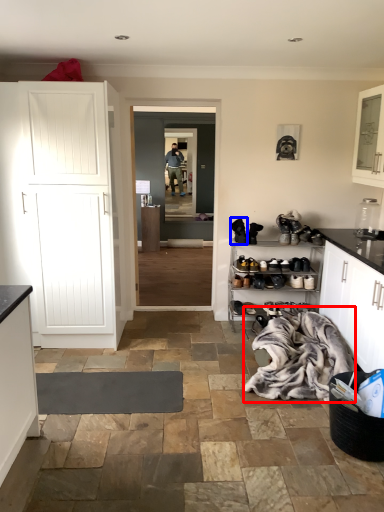
Question: Which point is further to the camera, laundry (highlighted by a red box) or footwear (highlighted by a blue box)?

Choices:
 (A) laundry
 (B) footwear

Answer: (B)